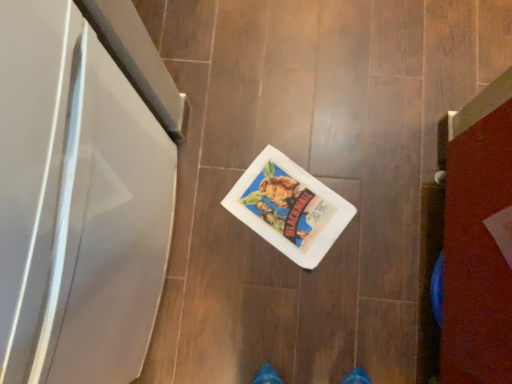
Measure the distance between white glossy screen door at left and camera.

white glossy screen door at left and camera are 38.46 centimeters apart.

This screenshot has width=512, height=384. What do you see at coordinates (80, 193) in the screenshot? I see `white glossy screen door at left` at bounding box center [80, 193].

What is the approximate width of white glossy screen door at left?

14.39 inches.

Image resolution: width=512 pixels, height=384 pixels. Find the location of `white glossy screen door at left`. white glossy screen door at left is located at coordinates (80, 193).

Locate an element on the screen. The width and height of the screenshot is (512, 384). white glossy screen door at left is located at coordinates (80, 193).